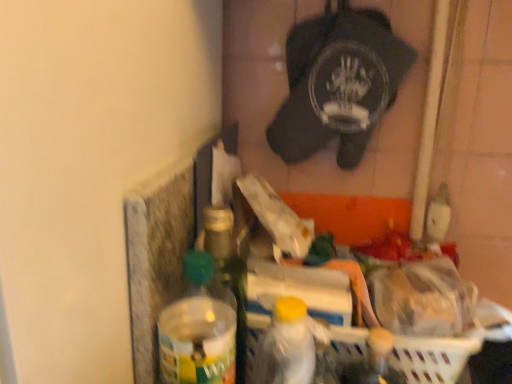
Question: In which direction should I rotate to look at white plastic bottle at center, the first bottle positioned from the right?

Choices:
 (A) right
 (B) left

Answer: (A)

Question: Is there a large distance between white plastic basket at lower right and white plastic bottle at center, the 3th bottle positioned from the left?

Choices:
 (A) no
 (B) yes

Answer: (A)

Question: Does white plastic basket at lower right have a lesser width compared to white plastic bottle at center, the 3th bottle positioned from the left?

Choices:
 (A) yes
 (B) no

Answer: (B)

Question: Can you confirm if white plastic basket at lower right is shorter than white plastic bottle at center, the 3th bottle positioned from the left?

Choices:
 (A) yes
 (B) no

Answer: (A)

Question: From a real-world perspective, is white plastic basket at lower right beneath white plastic bottle at center, the 3th bottle positioned from the left?

Choices:
 (A) no
 (B) yes

Answer: (B)

Question: Does white plastic basket at lower right appear on the left side of white plastic bottle at center, the first bottle positioned from the right?

Choices:
 (A) yes
 (B) no

Answer: (B)

Question: From the image's perspective, is white plastic basket at lower right on white plastic bottle at center, the first bottle positioned from the right?

Choices:
 (A) no
 (B) yes

Answer: (A)

Question: Is translucent plastic bottle at center, the 2th bottle viewed from the right, placed right next to white plastic basket at lower right?

Choices:
 (A) yes
 (B) no

Answer: (B)

Question: Considering the relative sizes of translucent plastic bottle at center, which is the second bottle in left-to-right order, and white plastic basket at lower right in the image provided, is translucent plastic bottle at center, which is the second bottle in left-to-right order, thinner than white plastic basket at lower right?

Choices:
 (A) yes
 (B) no

Answer: (A)

Question: Is translucent plastic bottle at center, which is the second bottle in left-to-right order, closer to the viewer compared to white plastic basket at lower right?

Choices:
 (A) yes
 (B) no

Answer: (B)

Question: Is translucent plastic bottle at center, which is the second bottle in left-to-right order, aimed at white plastic basket at lower right?

Choices:
 (A) yes
 (B) no

Answer: (A)

Question: Is translucent plastic bottle at center, the 2th bottle viewed from the right, looking in the opposite direction of white plastic basket at lower right?

Choices:
 (A) yes
 (B) no

Answer: (B)

Question: Is translucent plastic bottle at center, the 2th bottle viewed from the right, outside white plastic basket at lower right?

Choices:
 (A) yes
 (B) no

Answer: (A)

Question: From the image's perspective, would you say translucent plastic bottle at center, which is the second bottle in left-to-right order, is shown under white plastic bottle at center, the first bottle positioned from the right?

Choices:
 (A) yes
 (B) no

Answer: (B)